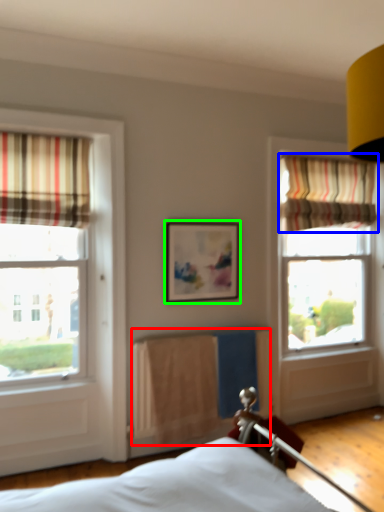
Question: Which object is the closest to the radiator (highlighted by a red box)? Choose among these: curtain (highlighted by a blue box) or picture frame (highlighted by a green box).

Choices:
 (A) curtain
 (B) picture frame

Answer: (B)